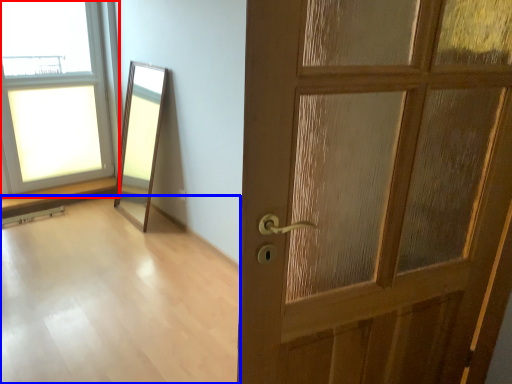
Question: Which point is closer to the camera, window (highlighted by a red box) or corridor (highlighted by a blue box)?

Choices:
 (A) window
 (B) corridor

Answer: (B)